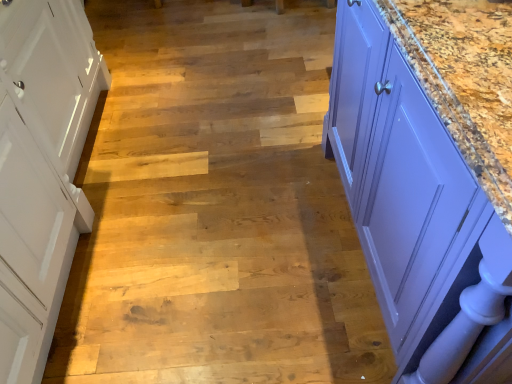
I want to click on free point to the right of white wood cabinet at left, so click(216, 187).